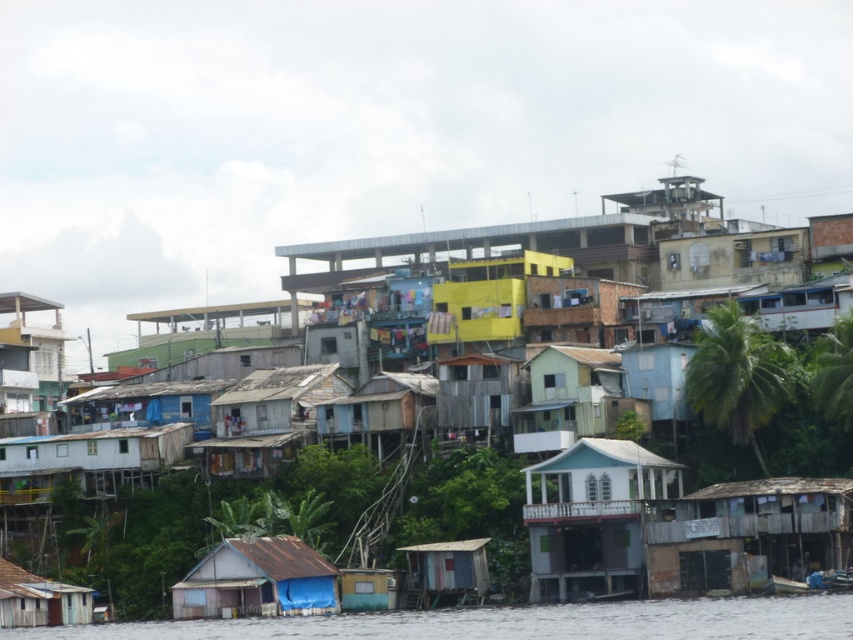
Question: Is weathered wood shack at lower right further to the viewer compared to white wood house at center?

Choices:
 (A) yes
 (B) no

Answer: (B)

Question: Does white wood house at center have a greater width compared to green painted wood house at center?

Choices:
 (A) no
 (B) yes

Answer: (B)

Question: Which point is farther to the camera?

Choices:
 (A) (622, 582)
 (B) (418, 588)
 (C) (556, 394)

Answer: (C)

Question: Which point is farther to the camera?

Choices:
 (A) weathered wood shack at lower right
 (B) white wood house at center
 (C) wooden hut at lower left
 (D) wooden shack at lower center

Answer: (C)

Question: Does weathered wood shack at lower right lie in front of wooden shack at lower center?

Choices:
 (A) no
 (B) yes

Answer: (B)

Question: Among these objects, which one is farthest from the camera?

Choices:
 (A) rusty metal hut at lower center
 (B) wooden shack at lower center

Answer: (B)